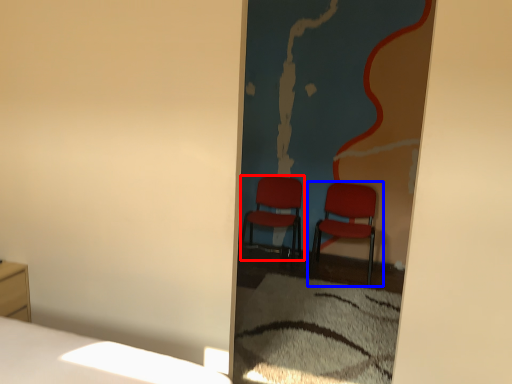
Question: Which of the following is the closest to the observer, chair (highlighted by a red box) or chair (highlighted by a blue box)?

Choices:
 (A) chair
 (B) chair

Answer: (B)